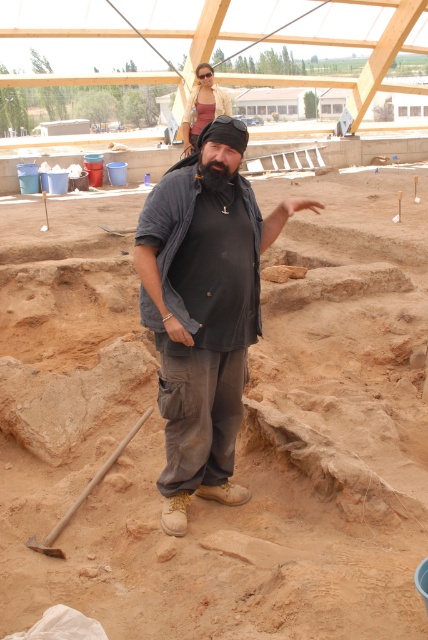
Question: Which point appears farthest from the camera in this image?

Choices:
 (A) (216, 164)
 (B) (178, 428)

Answer: (B)

Question: Where is gray cotton shirt at center located in relation to wooden shovel at lower left in the image?

Choices:
 (A) above
 (B) below

Answer: (A)

Question: Which object is the closest to the brown sandy soil at center?

Choices:
 (A) wooden shovel at lower left
 (B) bearded man at center

Answer: (A)

Question: Is brown sandy soil at center above gray cotton shirt at center?

Choices:
 (A) no
 (B) yes

Answer: (A)

Question: Which of the following is the closest to the observer?

Choices:
 (A) (196, 124)
 (B) (216, 465)
 (C) (107, 524)
 (D) (107, 470)

Answer: (C)

Question: Is bearded man at center thinner than wooden shovel at lower left?

Choices:
 (A) yes
 (B) no

Answer: (B)